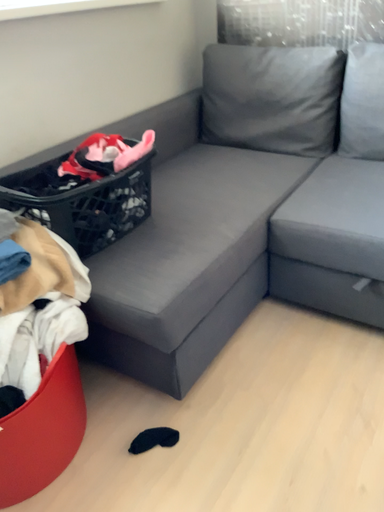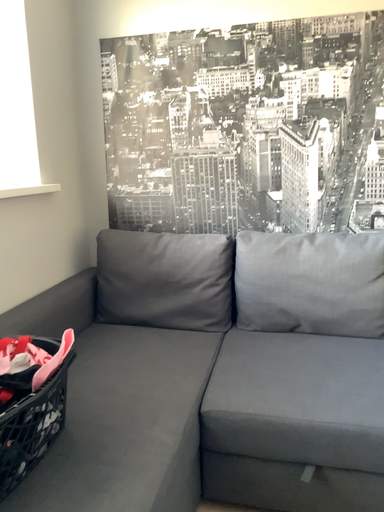
Question: How did the camera likely rotate when shooting the video?

Choices:
 (A) rotated right
 (B) rotated left

Answer: (A)